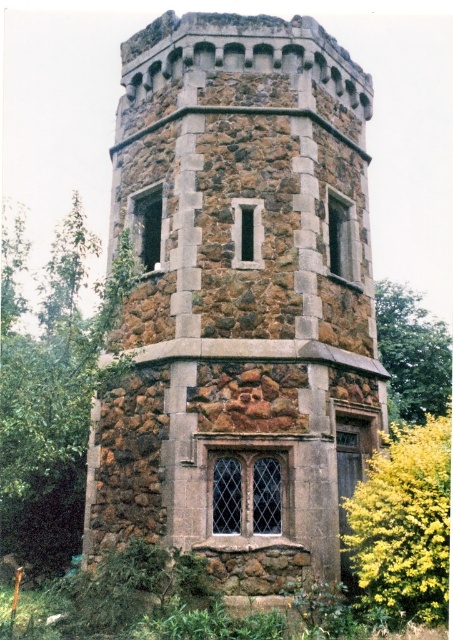
Question: Among these objects, which one is nearest to the camera?

Choices:
 (A) yellow leafy bush at lower right
 (B) brown stone tower at center

Answer: (A)

Question: Is green leafy tree at left to the right of green leafy tree at right from the viewer's perspective?

Choices:
 (A) no
 (B) yes

Answer: (A)

Question: Which of the following is the farthest from the observer?

Choices:
 (A) (439, 408)
 (B) (447, 468)

Answer: (A)

Question: Does brown stone tower at center come behind green leafy tree at left?

Choices:
 (A) no
 (B) yes

Answer: (B)

Question: Among these points, which one is farthest from the camera?

Choices:
 (A) (388, 292)
 (B) (414, 470)
 (C) (216, 164)

Answer: (A)

Question: In this image, where is green leafy tree at left located relative to yellow leafy bush at lower right?

Choices:
 (A) right
 (B) left

Answer: (B)